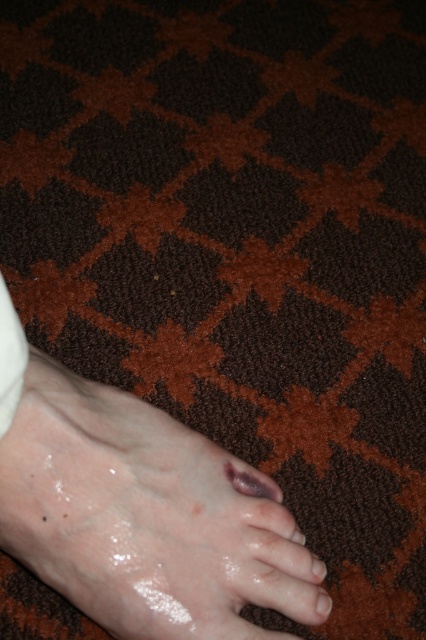
This screenshot has width=426, height=640. Find the location of `glossy pink toe at lower left`. glossy pink toe at lower left is located at coordinates (324, 604).

Does point (331, 604) lie in front of point (313, 563)?

That is False.

At what (x,y) coordinates should I click in order to perform the action: click on glossy pink toe at lower left. Please return your answer as a coordinate pair (x, y). Looking at the image, I should click on (324, 604).

Between point (275, 589) and point (261, 493), which one is positioned behind?

Positioned behind is point (261, 493).

Can you confirm if slick skin foot at lower center is shorter than purple matte toe at lower center?

No.

Is point (100, 484) closer to viewer compared to point (256, 486)?

Yes, point (100, 484) is closer to viewer.

Where is `slick skin foot at lower center`? Image resolution: width=426 pixels, height=640 pixels. slick skin foot at lower center is located at coordinates 141,516.

Can you confirm if slick skin foot at lower center is bigger than matte brown toe at lower center?

Yes.

Is slick skin foot at lower center thinner than matte brown toe at lower center?

In fact, slick skin foot at lower center might be wider than matte brown toe at lower center.

Identify the location of slick skin foot at lower center. (141, 516).

Where is `slick skin foot at lower center`? slick skin foot at lower center is located at coordinates (141, 516).